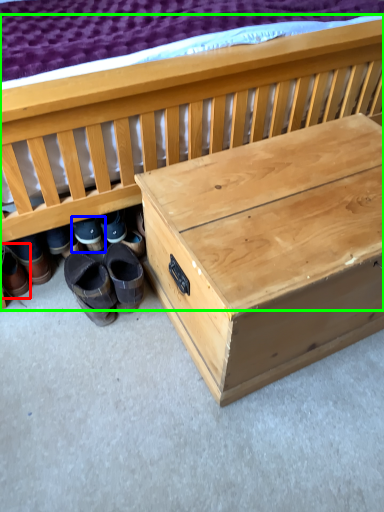
Question: Considering the real-world distances, which object is closest to footwear (highlighted by a red box)? footwear (highlighted by a blue box) or furniture (highlighted by a green box).

Choices:
 (A) footwear
 (B) furniture

Answer: (A)